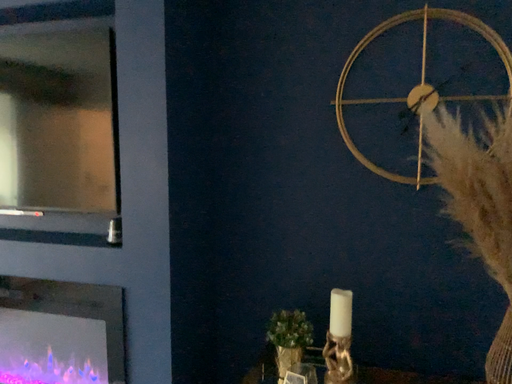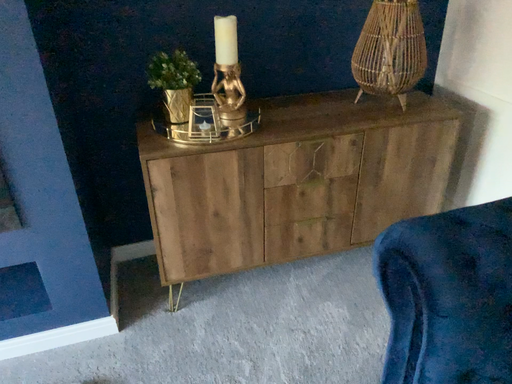
Question: Which way did the camera rotate in the video?

Choices:
 (A) rotated downward
 (B) rotated upward

Answer: (A)